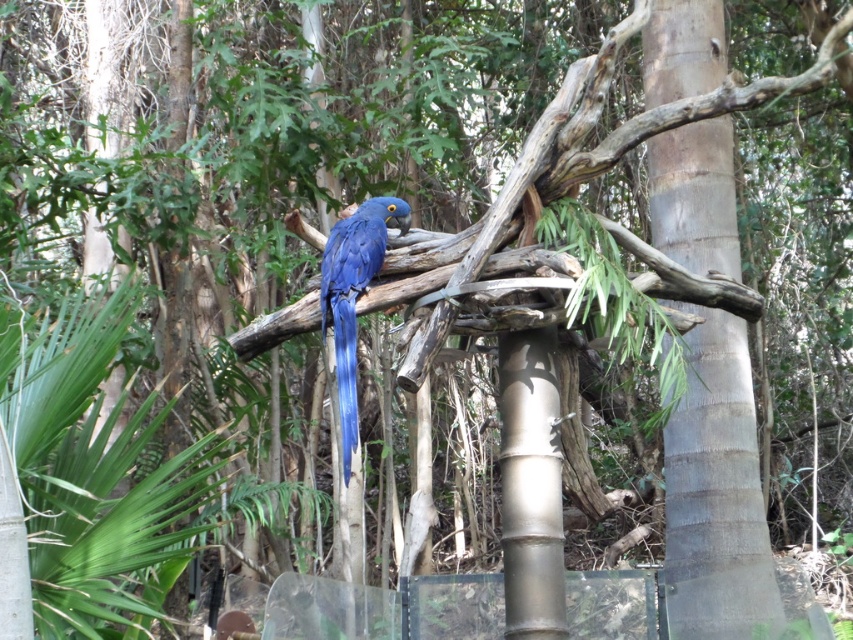
Does smooth gray tree trunk at center have a lesser width compared to brushed metal pole at center?

Incorrect, smooth gray tree trunk at center's width is not less than brushed metal pole at center's.

Locate an element on the screen. smooth gray tree trunk at center is located at coordinates (717, 496).

From the picture: Can you confirm if smooth gray tree trunk at center is positioned below blue glossy parrot at center?

Indeed, smooth gray tree trunk at center is positioned under blue glossy parrot at center.

This screenshot has height=640, width=853. What do you see at coordinates (717, 496) in the screenshot?
I see `smooth gray tree trunk at center` at bounding box center [717, 496].

This screenshot has height=640, width=853. What are the coordinates of `smooth gray tree trunk at center` in the screenshot? It's located at (717, 496).

Can you confirm if brushed metal pole at center is positioned to the left of blue glossy parrot at center?

In fact, brushed metal pole at center is to the right of blue glossy parrot at center.

Is point (514, 538) positioned in front of point (386, 214)?

Yes.

Which is behind, point (549, 637) or point (349, 230)?

Point (349, 230)

Locate an element on the screen. brushed metal pole at center is located at coordinates (531, 486).